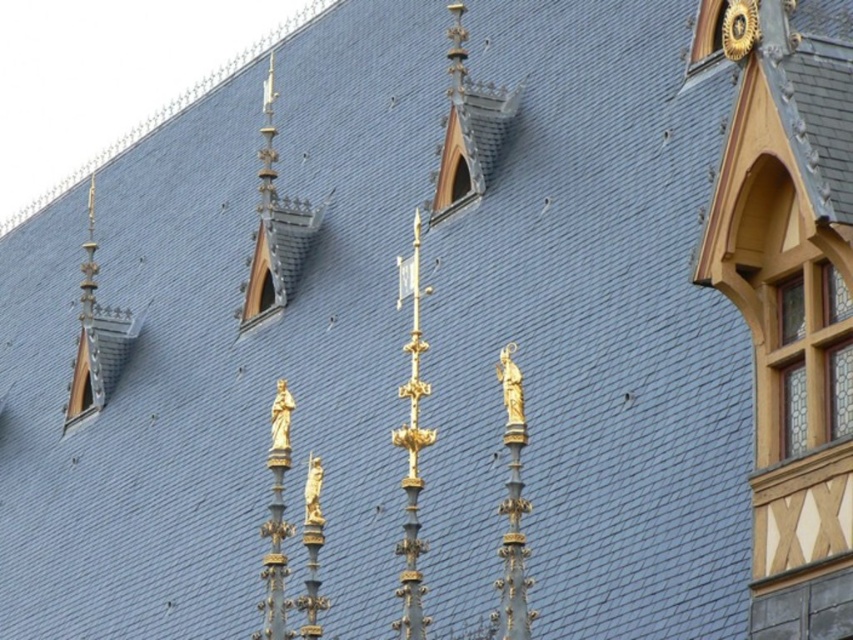
Which is more to the left, gold metallic clock at upper right or clear glass window at upper center?

From the viewer's perspective, clear glass window at upper center appears more on the left side.

Which is above, gold metallic clock at upper right or clear glass window at upper center?

gold metallic clock at upper right is higher up.

Describe the element at coordinates (740, 28) in the screenshot. This screenshot has width=853, height=640. I see `gold metallic clock at upper right` at that location.

Find the location of `gold metallic clock at upper right`. gold metallic clock at upper right is located at coordinates (740, 28).

Between transparent glass window at upper center and gold metallic clock at upper right, which one is positioned higher?

gold metallic clock at upper right is above.

Is point (450, 173) positioned after point (729, 20)?

Yes, point (450, 173) is behind point (729, 20).

This screenshot has width=853, height=640. I want to click on transparent glass window at upper center, so click(x=456, y=168).

Is transparent glass window at upper center further to the viewer compared to clear glass window at upper center?

That is False.

Who is taller, transparent glass window at upper center or clear glass window at upper center?

transparent glass window at upper center

Does point (467, 198) come behind point (467, 180)?

No.

This screenshot has width=853, height=640. I want to click on transparent glass window at upper center, so click(456, 168).